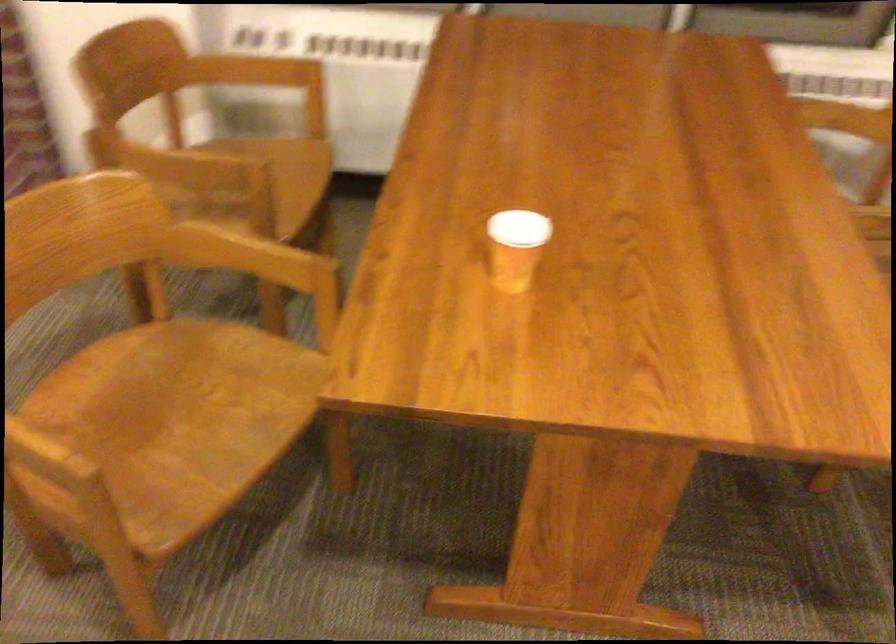
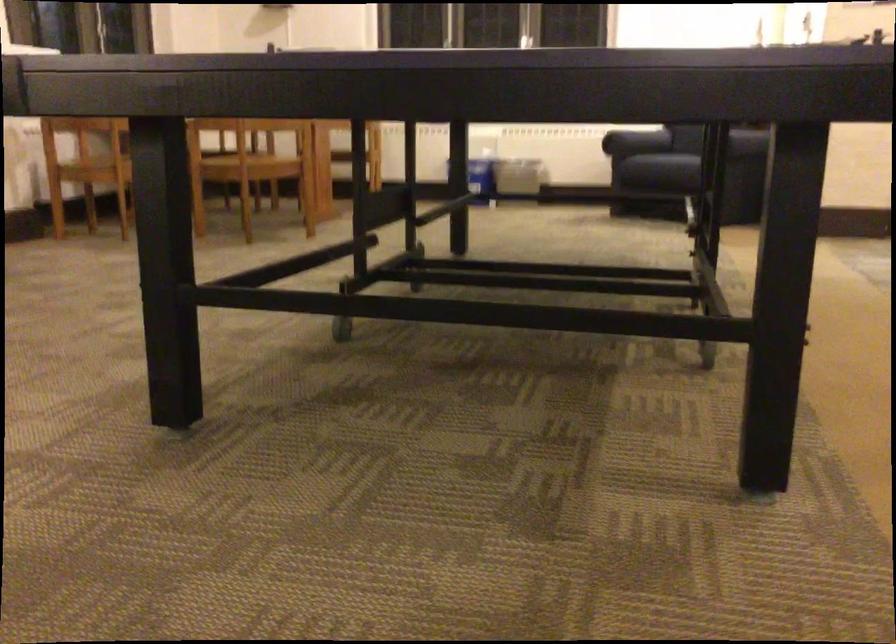
Question: I am providing you with two images of the same scene from different viewpoints. Please identify which objects are invisible in image2.

Choices:
 (A) white iron
 (B) sofa armrest
 (C) chair armrest
 (D) chair sitting surface

Answer: (C)